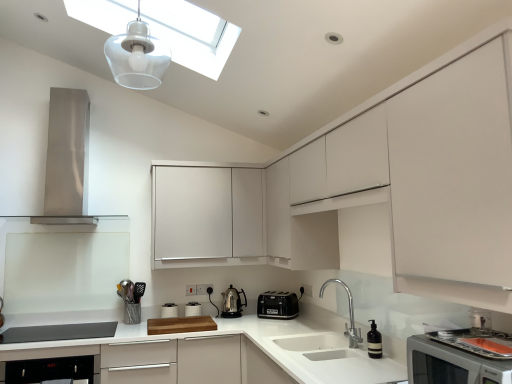
Question: Is translucent plastic light fixture at upper center not inside transparent glass skylight at upper center?

Choices:
 (A) yes
 (B) no

Answer: (A)

Question: Does translucent plastic light fixture at upper center have a larger size compared to transparent glass skylight at upper center?

Choices:
 (A) no
 (B) yes

Answer: (A)

Question: From a real-world perspective, is translucent plastic light fixture at upper center below transparent glass skylight at upper center?

Choices:
 (A) no
 (B) yes

Answer: (B)

Question: Is translucent plastic light fixture at upper center facing away from transparent glass skylight at upper center?

Choices:
 (A) no
 (B) yes

Answer: (A)

Question: Is translucent plastic light fixture at upper center not near transparent glass skylight at upper center?

Choices:
 (A) no
 (B) yes

Answer: (A)

Question: From a real-world perspective, is translucent plastic light fixture at upper center located higher than transparent glass skylight at upper center?

Choices:
 (A) yes
 (B) no

Answer: (B)

Question: Considering the relative positions of white matte countertop at center and stainless steel range hood at left, the third home appliance when ordered from right to left, in the image provided, is white matte countertop at center behind stainless steel range hood at left, the third home appliance when ordered from right to left,?

Choices:
 (A) yes
 (B) no

Answer: (B)

Question: Is white matte countertop at center to the right of stainless steel range hood at left, acting as the 1th home appliance starting from the left, from the viewer's perspective?

Choices:
 (A) yes
 (B) no

Answer: (A)

Question: Considering the relative sizes of white matte countertop at center and stainless steel range hood at left, marked as the third home appliance in a bottom-to-top arrangement, in the image provided, is white matte countertop at center thinner than stainless steel range hood at left, marked as the third home appliance in a bottom-to-top arrangement,?

Choices:
 (A) no
 (B) yes

Answer: (A)

Question: From the image's perspective, would you say white matte countertop at center is shown under stainless steel range hood at left, the third home appliance when ordered from right to left?

Choices:
 (A) no
 (B) yes

Answer: (B)

Question: Does white matte countertop at center come in front of stainless steel range hood at left, the third home appliance when ordered from right to left?

Choices:
 (A) yes
 (B) no

Answer: (A)

Question: Does white matte countertop at center have a larger size compared to stainless steel range hood at left, marked as the third home appliance in a bottom-to-top arrangement?

Choices:
 (A) yes
 (B) no

Answer: (A)

Question: Is metallic silver utensil holder at lower left inside black glossy dishwasher at lower left?

Choices:
 (A) yes
 (B) no

Answer: (B)